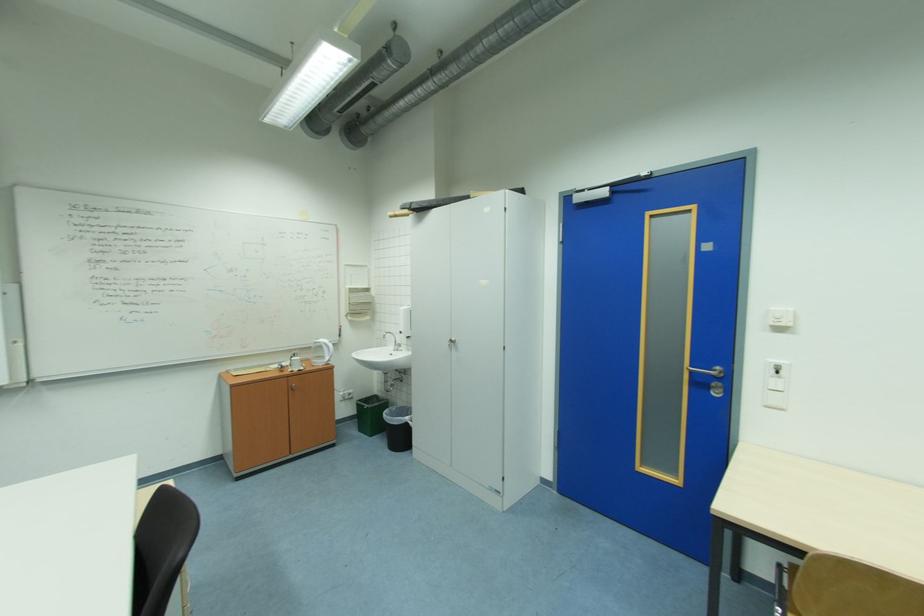
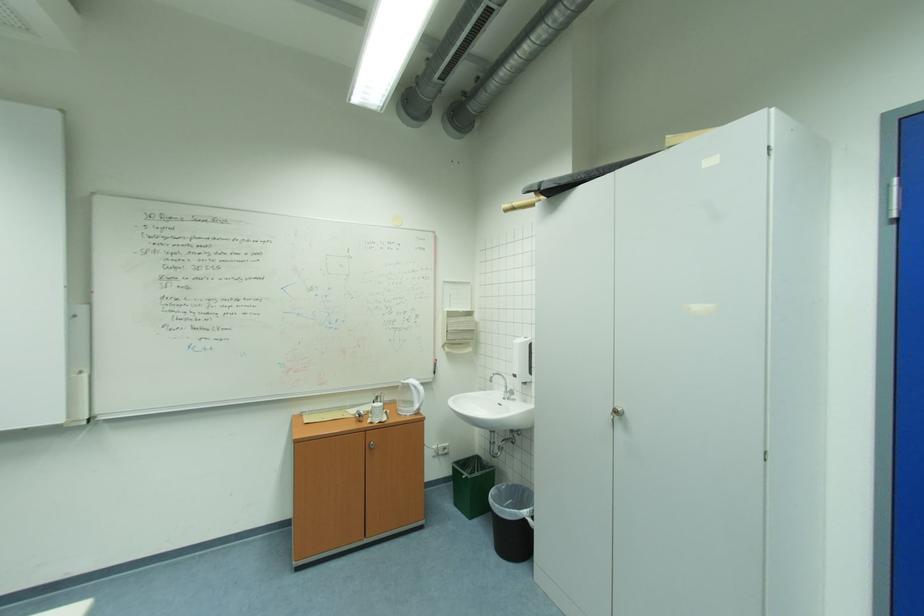
Question: The camera is either moving clockwise (left) or counter-clockwise (right) around the object. The first image is from the beginning of the video and the second image is from the end. Is the camera moving left or right when shooting the video?

Choices:
 (A) Left
 (B) Right

Answer: (B)